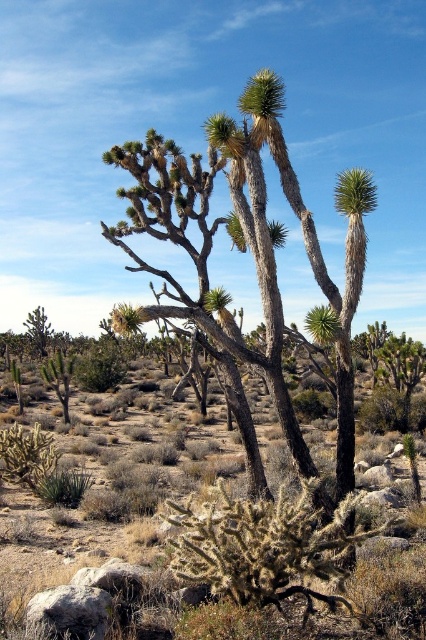
Does point (178, 467) come farther from viewer compared to point (270, 364)?

Yes, point (178, 467) is behind point (270, 364).

Who is lower down, brown spiny cactus at center or brown textured cactus at center?

brown spiny cactus at center is below.

Is point (334, 586) closer to viewer compared to point (143, 145)?

Yes, it is.

In order to click on brown spiny cactus at center in this screenshot , I will do `click(203, 538)`.